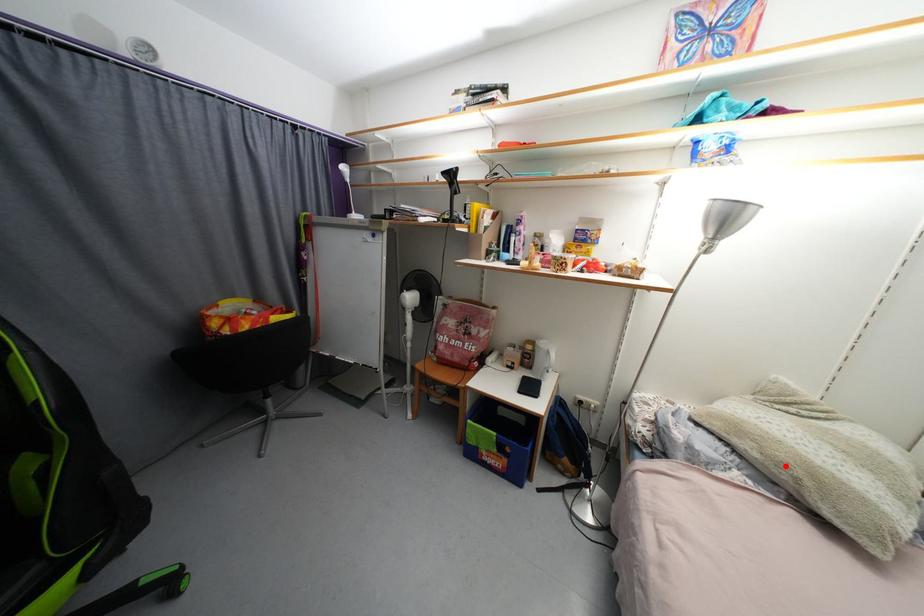
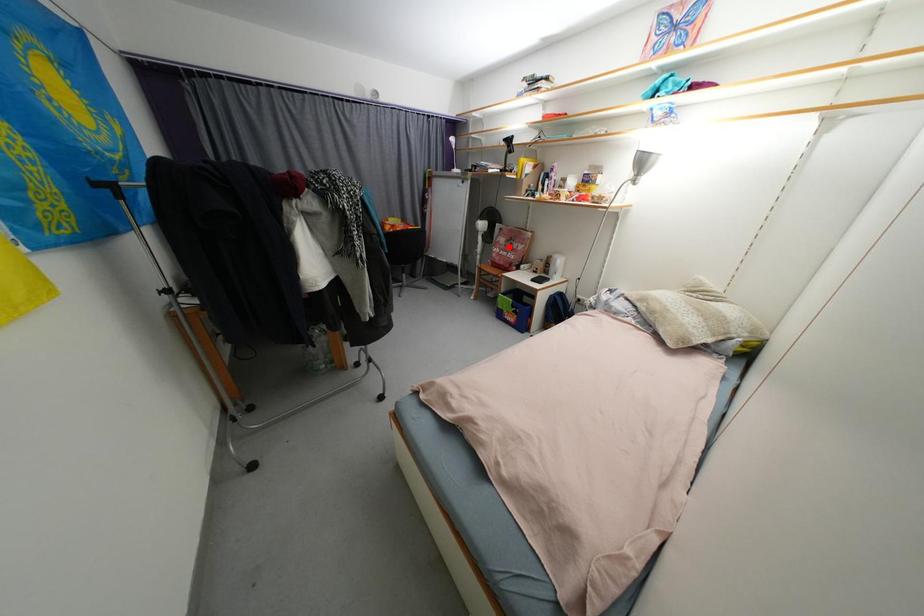
I am providing you with two images of the same scene from different viewpoints. A red point is marked on the first image and another point is marked on the second image. Is the red point in image1 aligned with the point shown in image2?

No